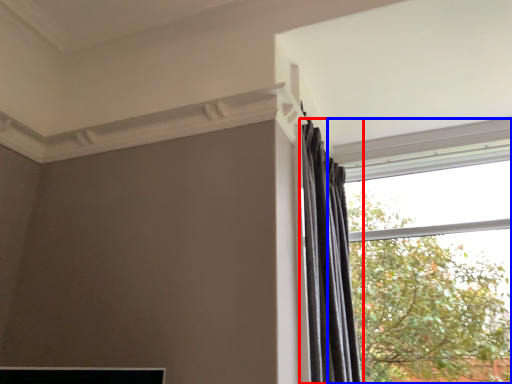
Question: Which object is further to the camera taking this photo, curtain (highlighted by a red box) or window (highlighted by a blue box)?

Choices:
 (A) curtain
 (B) window

Answer: (B)